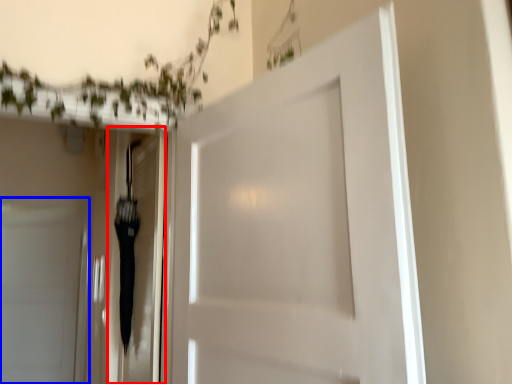
Question: Which of the following is the farthest to the observer, elevator (highlighted by a red box) or door (highlighted by a blue box)?

Choices:
 (A) elevator
 (B) door

Answer: (B)